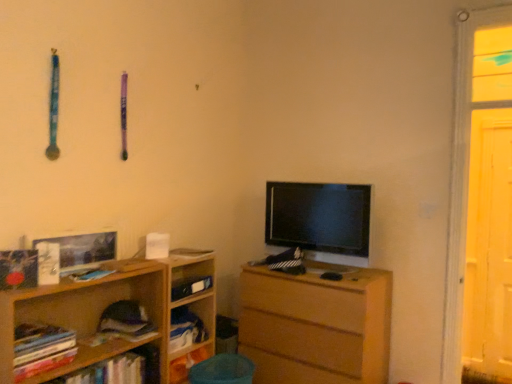
Question: In terms of width, does wooden bookshelf at left, which is the 2th shelf in back-to-front order, look wider or thinner when compared to soft purple fabric book at lower left, which ranks as the 3th book in front-to-back order?

Choices:
 (A) thin
 (B) wide

Answer: (B)

Question: From the image's perspective, relative to soft purple fabric book at lower left, acting as the second book starting from the back, is wooden bookshelf at left, the 1th shelf when ordered from front to back, above or below?

Choices:
 (A) below
 (B) above

Answer: (A)

Question: Which object is the closest to the soft purple fabric book at lower left, which ranks as the 3th book in front-to-back order?

Choices:
 (A) hardcover books at left, positioned as the 4th book in back-to-front order
 (B) wooden chest of drawers at center
 (C) wooden bookshelf at left, which is the 2th shelf in back-to-front order
 (D) wooden bookshelf at lower left, which ranks as the 1th shelf in back-to-front order
 (E) hardcover book at center, which is counted as the third book, starting from the back

Answer: (C)

Question: Which of these objects is positioned closest to the wooden chest of drawers at center?

Choices:
 (A) soft purple fabric book at lower left, which ranks as the 3th book in front-to-back order
 (B) hardcover book at center, marked as the 4th book in a front-to-back arrangement
 (C) wooden bookshelf at left, which is the 2th shelf in back-to-front order
 (D) wooden bookshelf at lower left, marked as the second shelf in a front-to-back arrangement
 (E) hardcover book at center, the second book viewed from the front

Answer: (D)